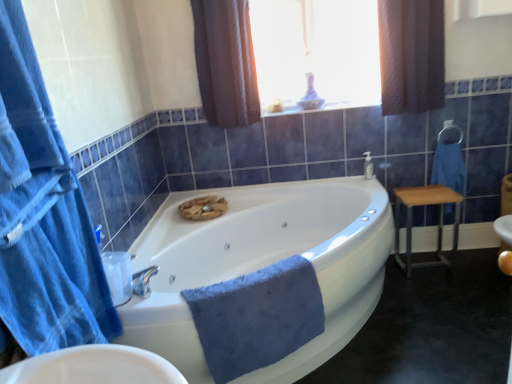
Question: Visually, is translucent glass vase at upper center positioned to the left or to the right of metallic silver towel bar at upper right?

Choices:
 (A) right
 (B) left

Answer: (B)

Question: From their relative heights in the image, would you say translucent glass vase at upper center is taller or shorter than metallic silver towel bar at upper right?

Choices:
 (A) tall
 (B) short

Answer: (A)

Question: Based on their relative distances, which object is farther from the metallic silver towel bar at upper right?

Choices:
 (A) blue cotton towel at right, marked as the second bath towel in a bottom-to-top arrangement
 (B) silver metallic faucet at upper right
 (C) brown textured curtain at upper center, which is the third curtain from front to back
 (D) white glossy bathtub at center
 (E) wooden/metallic stool at right

Answer: (C)

Question: Based on their relative distances, which object is farther from the white glossy bathtub at center?

Choices:
 (A) blue soft towel at center, which appears as the 1th bath towel when viewed from the front
 (B) blue cotton towel at right, which is the first bath towel in back-to-front order
 (C) blue fabric towel at left, the third curtain viewed from the back
 (D) brown textured curtain at upper right, which appears as the second curtain when viewed from the front
 (E) metallic silver towel bar at upper right

Answer: (E)